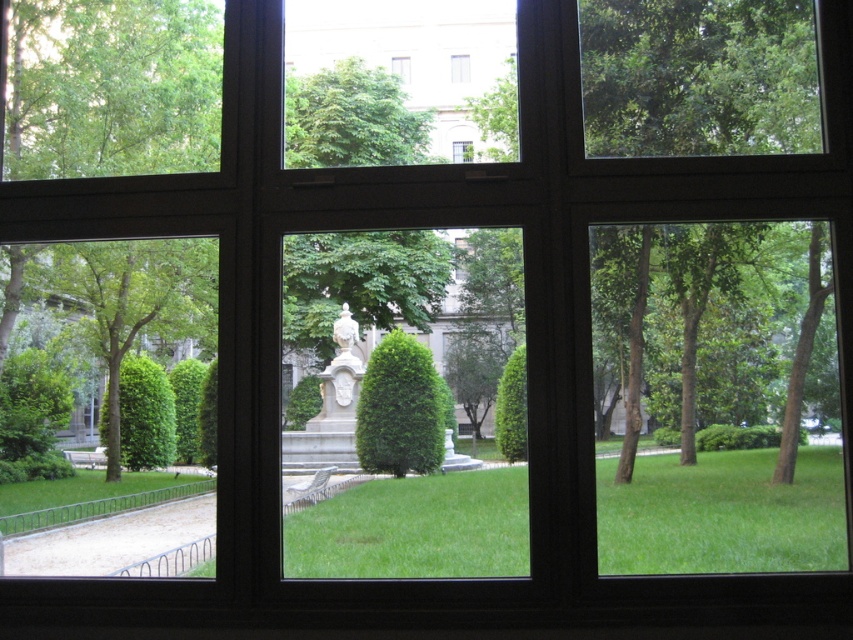
Question: Among these objects, which one is farthest from the camera?

Choices:
 (A) white marble statue at center
 (B) clear glass window at upper center

Answer: (B)

Question: Is clear glass window at upper center above transparent glass window at upper center?

Choices:
 (A) yes
 (B) no

Answer: (B)

Question: Which point is farther to the camera?

Choices:
 (A) (401, 72)
 (B) (393, 420)
 (C) (32, 300)

Answer: (A)

Question: Does green leafy tree at lower left appear on the right side of green leafy tree at center?

Choices:
 (A) yes
 (B) no

Answer: (B)

Question: Which point is closer to the camera?

Choices:
 (A) clear glass window at upper center
 (B) transparent glass window at upper center

Answer: (A)

Question: Is green leafy tree at lower left to the left of transparent glass window at center from the viewer's perspective?

Choices:
 (A) no
 (B) yes

Answer: (B)